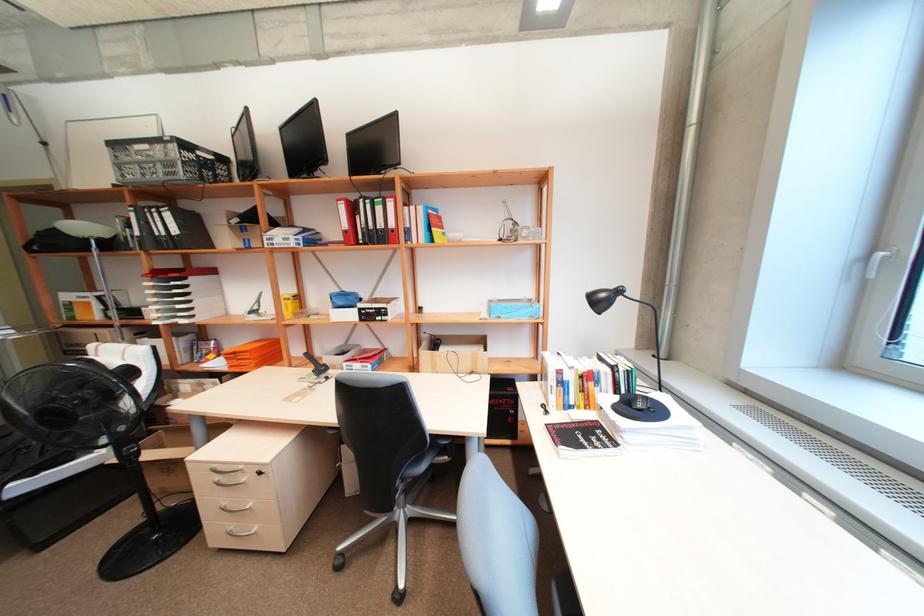
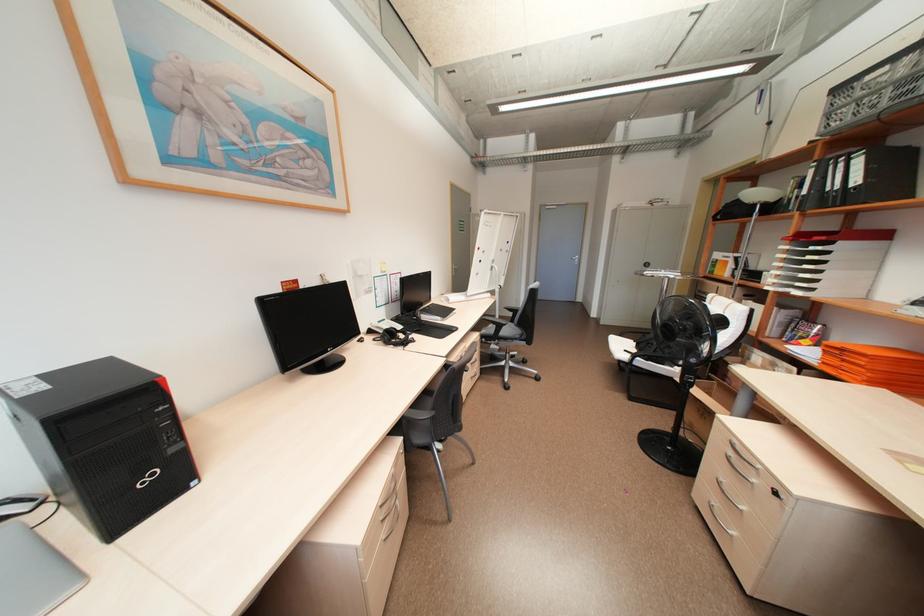
The point at (x=224, y=477) is marked in the first image. Where is the corresponding point in the second image?

(736, 453)